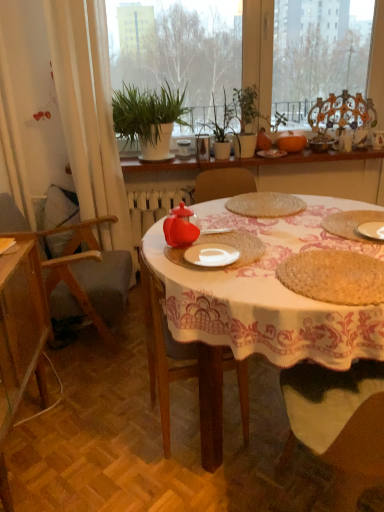
Where is `matte white plate at center, placed as the 1th tableware when sorted from left to right`? matte white plate at center, placed as the 1th tableware when sorted from left to right is located at coordinates tap(271, 153).

Where is `white fabric curtain at left`? Image resolution: width=384 pixels, height=512 pixels. white fabric curtain at left is located at coordinates click(x=89, y=115).

What do you see at coordinates (89, 115) in the screenshot? I see `white fabric curtain at left` at bounding box center [89, 115].

Locate an element on the screen. The width and height of the screenshot is (384, 512). orange matte pumpkin at center is located at coordinates (291, 142).

This screenshot has width=384, height=512. Describe the element at coordinates (339, 423) in the screenshot. I see `wooden chair at lower right, marked as the third chair in a top-to-bottom arrangement` at that location.

Locate an element on the screen. This screenshot has width=384, height=512. green leafy plant at upper center is located at coordinates (148, 117).

This screenshot has width=384, height=512. What are the coordinates of `white woven placemat at center` in the screenshot? It's located at (x=262, y=306).

Based on the photo, do you think green leafy plants at upper center is within wooden shelf at center, or outside of it?

The correct answer is: outside.

Considering the sizes of green leafy plants at upper center and wooden shelf at center in the image, is green leafy plants at upper center wider or thinner than wooden shelf at center?

Clearly, green leafy plants at upper center has less width compared to wooden shelf at center.

From the image's perspective, which object appears higher, green leafy plants at upper center or wooden shelf at center?

Result: From the image's view, green leafy plants at upper center is above.

Locate an element on the screen. Image resolution: width=384 pixels, height=512 pixels. window screen above the wooden shelf at center (from a real-world perspective) is located at coordinates (175, 47).

Based on the photo, from the image's perspective, who appears lower, transparent glass chair at upper right, the 1th chair positioned from the right, or wooden cabinet at lower left?

wooden cabinet at lower left, from the image's perspective.

In the scene shown: Could you measure the distance between transparent glass chair at upper right, which is the 3th chair from front to back, and wooden cabinet at lower left?

A distance of 6.95 feet exists between transparent glass chair at upper right, which is the 3th chair from front to back, and wooden cabinet at lower left.

Consider the image. Which of these two, transparent glass chair at upper right, which is the third chair in left-to-right order, or wooden cabinet at lower left, is smaller?

transparent glass chair at upper right, which is the third chair in left-to-right order, is smaller.

Considering the relative positions of transparent glass chair at upper right, which is the 3th chair from front to back, and wooden cabinet at lower left in the image provided, is transparent glass chair at upper right, which is the 3th chair from front to back, to the left of wooden cabinet at lower left from the viewer's perspective?

In fact, transparent glass chair at upper right, which is the 3th chair from front to back, is to the right of wooden cabinet at lower left.

From a real-world perspective, which is physically above, green matte plant at center or wooden cabinet at lower left?

In real-world perspective, green matte plant at center is above.

Can we say green matte plant at center lies outside wooden cabinet at lower left?

Yes, green matte plant at center is located beyond the bounds of wooden cabinet at lower left.

From the image's perspective, between green matte plant at center and wooden cabinet at lower left, which one is located above?

green matte plant at center is shown above in the image.

Between green leafy plant at upper center and white ceramic plate at center, which one appears on the right side from the viewer's perspective?

white ceramic plate at center is more to the right.

Is green leafy plant at upper center turned away from white ceramic plate at center?

No, green leafy plant at upper center is not facing the opposite direction of white ceramic plate at center.

Considering the relative positions of green leafy plant at upper center and white ceramic plate at center in the image provided, is green leafy plant at upper center behind white ceramic plate at center?

Yes, it is behind white ceramic plate at center.

Is green leafy plant at upper center placed right next to white ceramic plate at center?

No, green leafy plant at upper center is not making contact with white ceramic plate at center.

In the image, is matte white plate at center, arranged as the second tableware when viewed from the right, on the left side or the right side of transparent glass chair at upper right, the 1th chair positioned from the right?

matte white plate at center, arranged as the second tableware when viewed from the right, is to the left of transparent glass chair at upper right, the 1th chair positioned from the right.

Are matte white plate at center, arranged as the second tableware when viewed from the right, and transparent glass chair at upper right, the 1th chair in the top-to-bottom sequence, making contact?

matte white plate at center, arranged as the second tableware when viewed from the right, and transparent glass chair at upper right, the 1th chair in the top-to-bottom sequence, are clearly separated.

Between matte white plate at center, arranged as the second tableware when viewed from the right, and transparent glass chair at upper right, the first chair in the back-to-front sequence, which one is positioned in front?

matte white plate at center, arranged as the second tableware when viewed from the right, is in front.

Relative to matte glass teapot at center, is wooden shelf at center in front or behind?

wooden shelf at center is behind matte glass teapot at center.

Can you confirm if wooden shelf at center is taller than matte glass teapot at center?

No.

Is wooden shelf at center wider than matte glass teapot at center?

Yes.

Looking at the image, does wooden shelf at center seem bigger or smaller compared to matte glass teapot at center?

In the image, wooden shelf at center appears to be larger than matte glass teapot at center.

How much distance is there between matte white plate at center, arranged as the second tableware when viewed from the right, and green leafy plant at upper center?

matte white plate at center, arranged as the second tableware when viewed from the right, and green leafy plant at upper center are 29.22 inches apart.

At what (x,y) coordinates should I click in order to perform the action: click on the 2nd tableware below the green leafy plant at upper center (from a real-world perspective). Please return your answer as a coordinate pair (x, y). Looking at the image, I should click on (271, 153).

Is the depth of matte white plate at center, placed as the 1th tableware when sorted from left to right, greater than that of green leafy plant at upper center?

That is True.

Which is closer, (268, 149) or (142, 144)?

Point (268, 149).

Locate an element on the screen. This screenshot has height=512, width=384. window sill behind the green leafy plants at upper center is located at coordinates (247, 161).

Locate an element on the screen. This screenshot has width=384, height=512. cabinetry that appears in front of the transparent glass chair at upper right, which is the third chair in left-to-right order is located at coordinates (20, 338).

Consider the image. From the image, which object appears to be nearer to transparent glass chair at upper right, the 1th chair positioned from the right, white woven placemat at center or white ceramic plate at center?

Based on the image, white woven placemat at center appears to be nearer to transparent glass chair at upper right, the 1th chair positioned from the right.

Estimate the real-world distances between objects in this image. Which object is further from green leafy plant at upper center, matte ceramic bowl at upper right, the 1th tableware viewed from the right, or transparent glass chair at upper right, which is the 3th chair from front to back?

matte ceramic bowl at upper right, the 1th tableware viewed from the right, is further to green leafy plant at upper center.

Which object lies further to the anchor point wooden shelf at center, green matte plant at center or matte glass teapot at center?

matte glass teapot at center is further to wooden shelf at center.

Estimate the real-world distances between objects in this image. Which object is further from orange matte pumpkin at center, white woven placemat at center or green leafy plant at upper center?

white woven placemat at center lies further to orange matte pumpkin at center than the other object.

Considering their positions, is wooden chair at lower right, the 3th chair positioned from the back, positioned closer to transparent glass chair at upper right, the first chair in the back-to-front sequence, than green leafy plant at upper center?

green leafy plant at upper center is closer to transparent glass chair at upper right, the first chair in the back-to-front sequence.

Based on their spatial positions, is green matte plant at center or white woven placemat at center closer to wooden chair at lower right, the 2th chair when ordered from right to left?

white woven placemat at center is positioned closer to the anchor wooden chair at lower right, the 2th chair when ordered from right to left.

From the picture: From the image, which object appears to be nearer to green leafy plants at upper center, wooden chair at left, which is the first chair from left to right, or matte white plate at center, arranged as the second tableware when viewed from the right?

matte white plate at center, arranged as the second tableware when viewed from the right.

When comparing their distances from transparent glass chair at upper right, the 1th chair positioned from the right, does wooden shelf at center or matte glass teapot at center seem further?

matte glass teapot at center lies further to transparent glass chair at upper right, the 1th chair positioned from the right, than the other object.

Where is `plate located between wooden cabinet at lower left and wooden shelf at center in the depth direction`? The image size is (384, 512). plate located between wooden cabinet at lower left and wooden shelf at center in the depth direction is located at coordinates (211, 255).

This screenshot has height=512, width=384. Identify the location of plant between green leafy plant at upper center and transparent glass chair at upper right, which is the third chair in left-to-right order. (223, 130).

Identify the location of plant between green leafy plants at upper center and wooden chair at left, which is the first chair from left to right, vertically. (223, 130).

This screenshot has width=384, height=512. I want to click on teapot between wooden cabinet at lower left and transparent glass chair at upper right, the 1th chair in the top-to-bottom sequence, from front to back, so click(x=180, y=227).